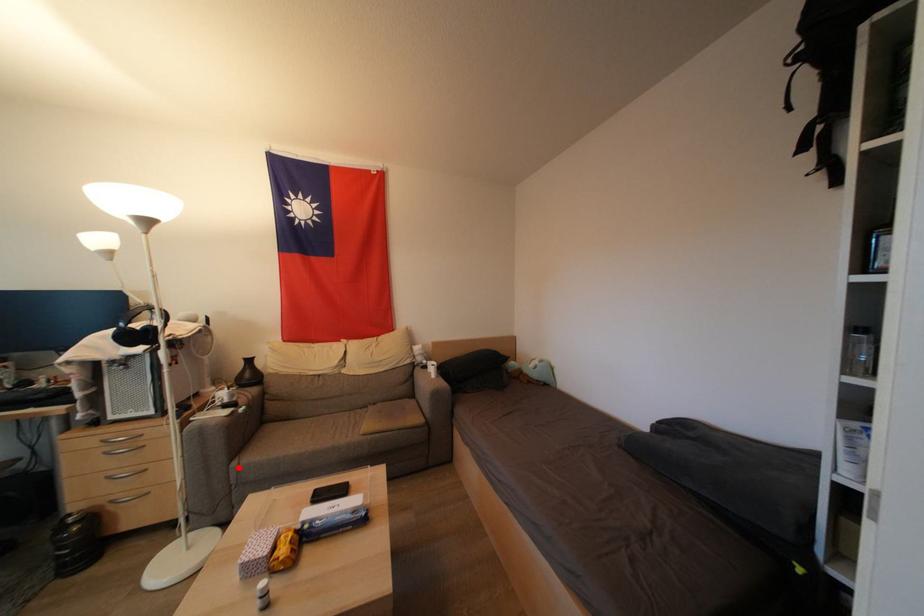
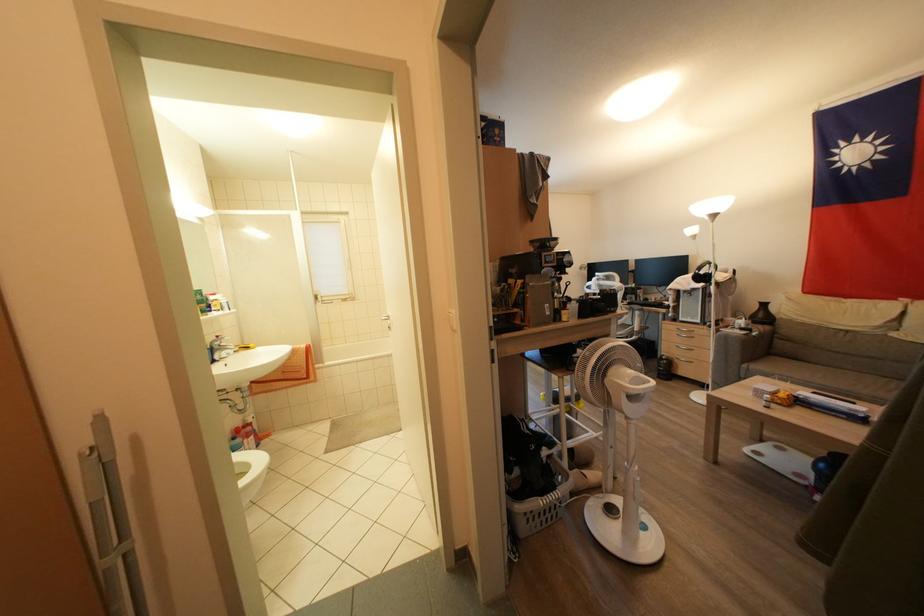
Find the pixel in the second image that matches the highlighted location in the first image.

(748, 370)